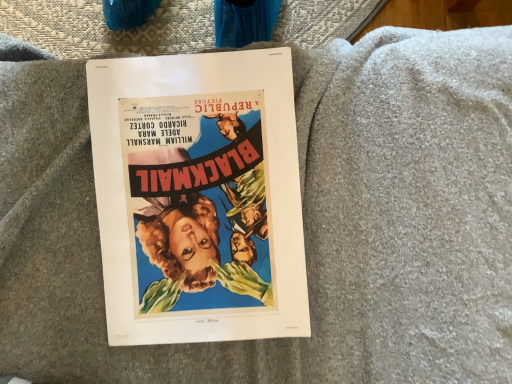
Measure the distance between point [253,286] and camera.

The depth of point [253,286] is 17.17 inches.

What is the approximate width of matte paper poster at center?

matte paper poster at center is 12.13 inches wide.

This screenshot has height=384, width=512. What do you see at coordinates (198, 197) in the screenshot? I see `matte paper poster at center` at bounding box center [198, 197].

In order to face matte paper poster at center, should I rotate leftwards or rightwards?

To face it directly, rotate left by 8.010 degrees.

Locate an element on the screen. The height and width of the screenshot is (384, 512). matte paper poster at center is located at coordinates (198, 197).

What is the approximate height of matte paper poster at center?

The height of matte paper poster at center is 1.15 inches.

Find the location of a particular element. The height and width of the screenshot is (384, 512). matte paper poster at center is located at coordinates (198, 197).